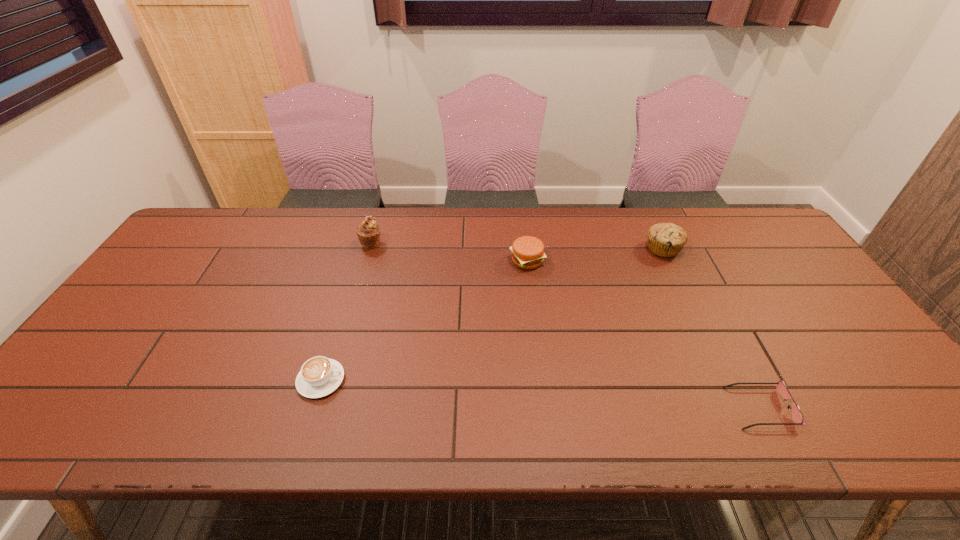
Find the location of a particular element. This screenshot has width=960, height=540. object that can be found as the fourth closest to the right muffin is located at coordinates (319, 376).

Image resolution: width=960 pixels, height=540 pixels. What are the coordinates of `vacant space that satisfies the following two spatial constraints: 1. on the front side of the third shortest object; 2. on the side of the second shortest object with the handle` in the screenshot? It's located at (541, 380).

You are a GUI agent. You are given a task and a screenshot of the screen. Output one action in this format:
    pyautogui.click(x=<x>, y=<y>)
    Task: Click on the free location that satisfies the following two spatial constraints: 1. on the front side of the left muffin; 2. on the right side of the right muffin
    
    Given the screenshot: What is the action you would take?
    pyautogui.click(x=370, y=249)

Find the location of a particular element. free space that satisfies the following two spatial constraints: 1. on the front side of the hamburger; 2. on the side of the cappuccino with the handle is located at coordinates (541, 380).